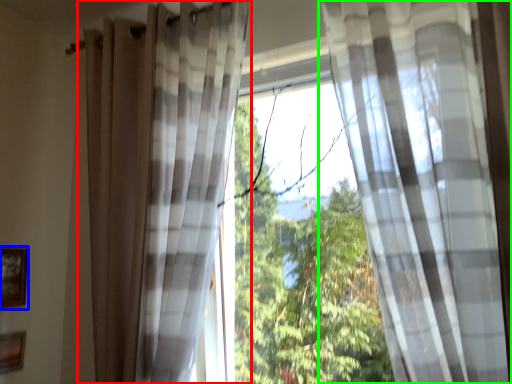
Question: Which object is the farthest from curtain (highlighted by a red box)? Choose among these: picture frame (highlighted by a blue box) or curtain (highlighted by a green box).

Choices:
 (A) picture frame
 (B) curtain

Answer: (A)